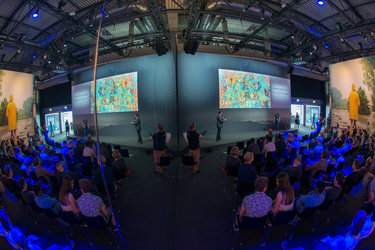
The width and height of the screenshot is (375, 250). Identify the location of door. (309, 111), (59, 119).